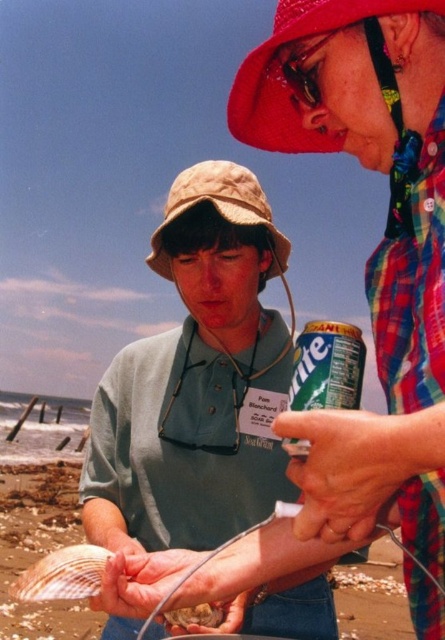
Who is more distant from viewer, (48, 476) or (37, 582)?

The point (48, 476) is behind.

What do you see at coordinates (41, 484) in the screenshot?
I see `white shell at center` at bounding box center [41, 484].

Identify the location of white shell at center. (41, 484).

Who is lower down, white shell at center or matte plastic goggles at upper center?

white shell at center is below.

Is point (48, 464) less distant than point (294, 56)?

No, (48, 464) is behind (294, 56).

Between point (35, 499) and point (322, 38), which one is positioned in front?

Point (322, 38) is more forward.

This screenshot has height=640, width=445. I want to click on white shell at center, so click(x=41, y=484).

Looking at this image, who is more forward, (270, 60) or (172, 618)?

Point (270, 60) is more forward.

Who is lower down, red fabric hat at upper center or fuzzy brown fur at lower center?

Positioned lower is fuzzy brown fur at lower center.

Describe the element at coordinates (283, 77) in the screenshot. I see `red fabric hat at upper center` at that location.

Where is `red fabric hat at upper center`? This screenshot has height=640, width=445. red fabric hat at upper center is located at coordinates (283, 77).